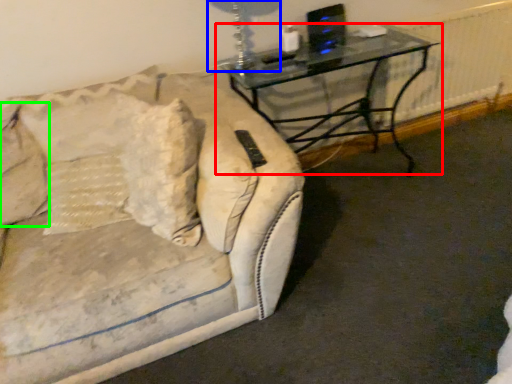
Question: Considering the real-world distances, which object is closest to table (highlighted by a red box)? table lamp (highlighted by a blue box) or pillow (highlighted by a green box).

Choices:
 (A) table lamp
 (B) pillow

Answer: (A)